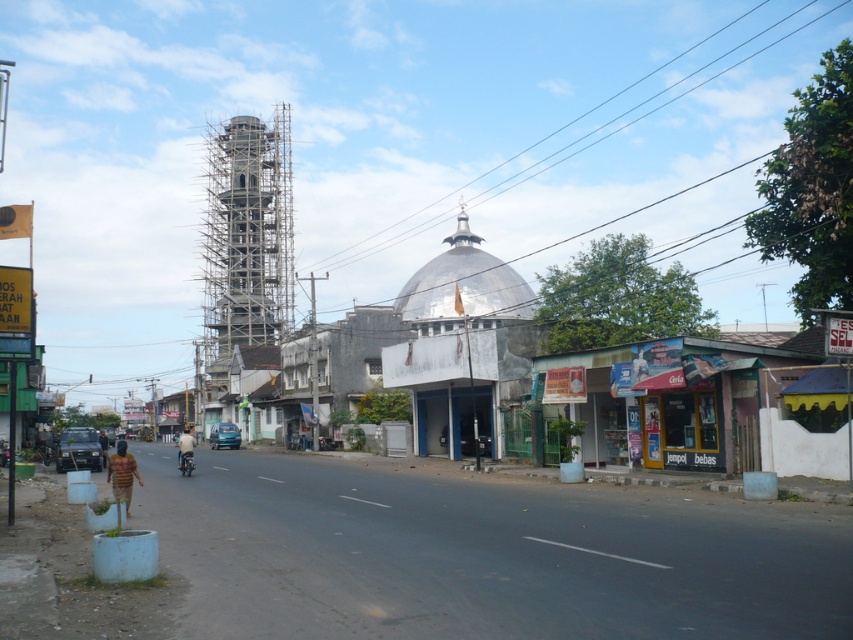
You are a delivery person trying to navigate through the town. You need to deliver a package to the domed building with a metallic roof. There is a point at coordinates point (x=245, y=241) on scaffolding wooden structure at center left. Can you safely walk past this point to reach the domed building?

The point (x=245, y=241) is on scaffolding wooden structure at center left, so you should avoid walking past this point as it is part of an unstable construction area and may pose a safety hazard.